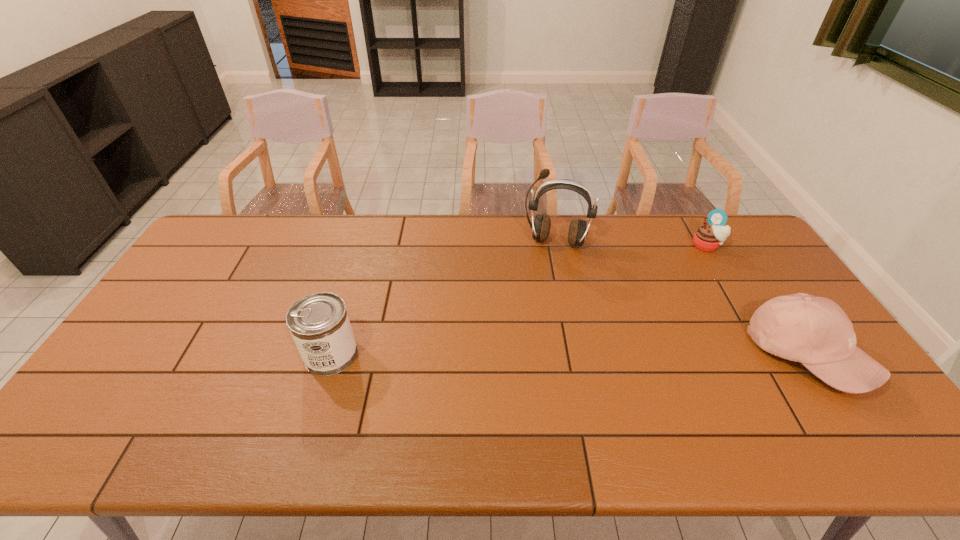
At what (x,y) coordinates should I click in order to perform the action: click on free space on the desktop that is between the leftmost object and the baseball cap and is positioned on the ear pads of the second object from left to right. Please return your answer as a coordinate pair (x, y). This screenshot has height=540, width=960. Looking at the image, I should click on (537, 354).

Locate an element on the screen. vacant space on the desktop that is between the can and the baseball cap and is positioned on the front-facing side of the muffin is located at coordinates (613, 354).